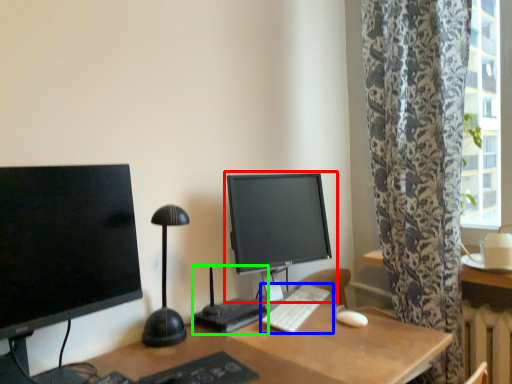
Question: Which object is positioned farthest from computer monitor (highlighted by a red box)? Select from computer keyboard (highlighted by a blue box) and computer desk (highlighted by a green box).

Choices:
 (A) computer keyboard
 (B) computer desk

Answer: (B)